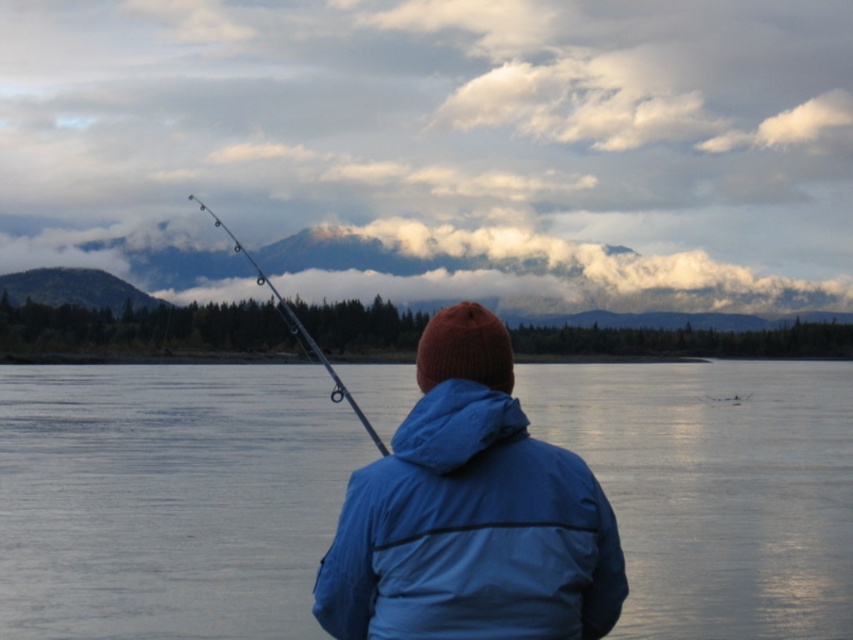
You are standing behind the person fishing and want to know the relative positions of the smooth water at center and the metallic rod at upper center. Which object is located to the right of the other?

The smooth water at center is positioned on the right side of metallic rod at upper center.